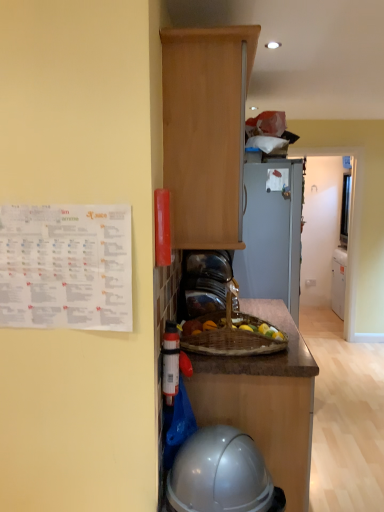
Question: Are brown polished wood at center and wooden cabinet at upper center making contact?

Choices:
 (A) no
 (B) yes

Answer: (A)

Question: Is brown polished wood at center far away from wooden cabinet at upper center?

Choices:
 (A) yes
 (B) no

Answer: (B)

Question: Considering the relative sizes of brown polished wood at center and wooden cabinet at upper center in the image provided, is brown polished wood at center wider than wooden cabinet at upper center?

Choices:
 (A) no
 (B) yes

Answer: (B)

Question: Is brown polished wood at center aimed at wooden cabinet at upper center?

Choices:
 (A) no
 (B) yes

Answer: (A)

Question: Could wooden cabinet at upper center be considered to be inside brown polished wood at center?

Choices:
 (A) no
 (B) yes

Answer: (A)

Question: Is brown polished wood at center thinner than wooden cabinet at upper center?

Choices:
 (A) no
 (B) yes

Answer: (A)

Question: Considering the relative sizes of glossy plastic helmet at lower center and brown polished wood at center in the image provided, is glossy plastic helmet at lower center smaller than brown polished wood at center?

Choices:
 (A) yes
 (B) no

Answer: (B)

Question: Would you say glossy plastic helmet at lower center is a long distance from brown polished wood at center?

Choices:
 (A) yes
 (B) no

Answer: (B)

Question: Does glossy plastic helmet at lower center appear on the left side of brown polished wood at center?

Choices:
 (A) yes
 (B) no

Answer: (A)

Question: Is glossy plastic helmet at lower center further to the viewer compared to brown polished wood at center?

Choices:
 (A) yes
 (B) no

Answer: (B)

Question: From a real-world perspective, is glossy plastic helmet at lower center located beneath brown polished wood at center?

Choices:
 (A) yes
 (B) no

Answer: (A)

Question: Is glossy plastic helmet at lower center directly adjacent to brown polished wood at center?

Choices:
 (A) yes
 (B) no

Answer: (B)

Question: Is wooden cabinet at upper center looking in the opposite direction of glossy plastic helmet at lower center?

Choices:
 (A) yes
 (B) no

Answer: (B)